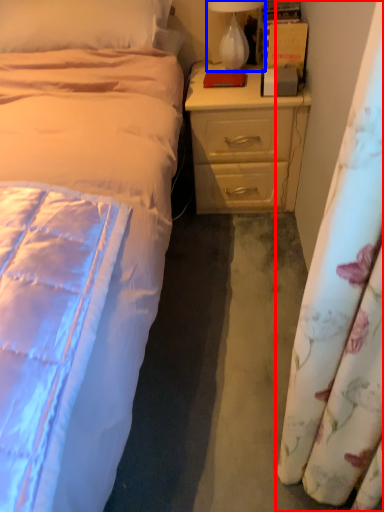
Question: Among these objects, which one is nearest to the camera, curtain (highlighted by a red box) or lamp (highlighted by a blue box)?

Choices:
 (A) curtain
 (B) lamp

Answer: (A)